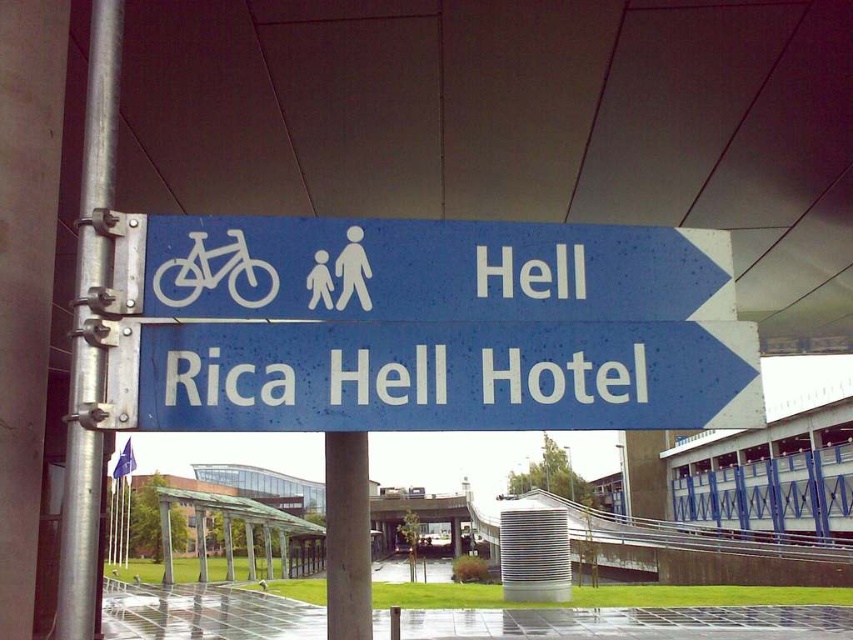
You are a delivery person with a 4.5 feet wide cart. You need to pass between the smooth concrete pillar at center and the white matte bicycle at left. Can your cart fit through the space between them?

The smooth concrete pillar at center and white matte bicycle at left are 4.66 feet apart from each other. Since your cart is 4.5 feet wide, it can fit through the space between them as the gap is slightly wider than the cart.

You are a delivery person who needs to attach a package to the tallest object between the blue plastic sign at upper center and the smooth concrete pillar at center. Which object should you choose?

The smooth concrete pillar at center is taller than the blue plastic sign at upper center, so you should attach the package to the smooth concrete pillar at center.